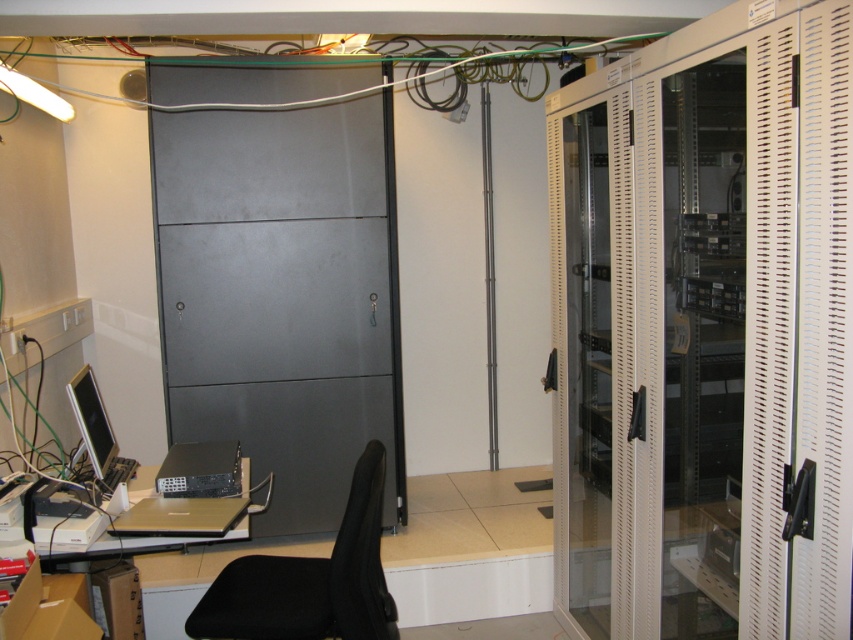
Based on the photo, does black fabric swivel chair at lower center have a lesser width compared to matte black desk at lower left?

Yes, black fabric swivel chair at lower center is thinner than matte black desk at lower left.

Does black fabric swivel chair at lower center have a larger size compared to matte black desk at lower left?

Correct, black fabric swivel chair at lower center is larger in size than matte black desk at lower left.

This screenshot has width=853, height=640. What do you see at coordinates (310, 580) in the screenshot?
I see `black fabric swivel chair at lower center` at bounding box center [310, 580].

Where is `black fabric swivel chair at lower center`? The height and width of the screenshot is (640, 853). black fabric swivel chair at lower center is located at coordinates (310, 580).

Between metallic gray locker at center and matte black monitor at left, which one is positioned higher?

metallic gray locker at center

How far apart are metallic gray locker at center and matte black monitor at left?

metallic gray locker at center and matte black monitor at left are 81.54 centimeters apart.

Where is `metallic gray locker at center`? This screenshot has height=640, width=853. metallic gray locker at center is located at coordinates (282, 296).

Is beige perforated locker at right shorter than metallic gray locker at center?

Yes, beige perforated locker at right is shorter than metallic gray locker at center.

Is beige perforated locker at right behind metallic gray locker at center?

No, it is not.

Locate an element on the screen. Image resolution: width=853 pixels, height=640 pixels. beige perforated locker at right is located at coordinates (706, 330).

I want to click on beige perforated locker at right, so click(706, 330).